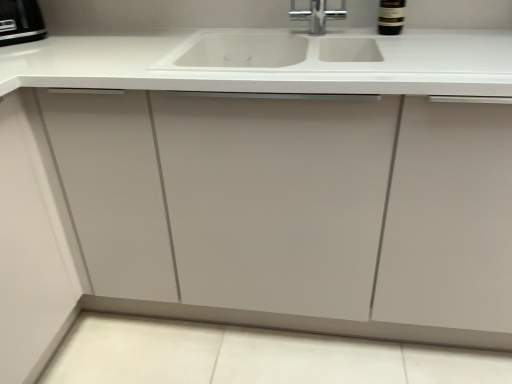
Question: Should I look upward or downward to see black plastic toaster at upper left?

Choices:
 (A) up
 (B) down

Answer: (A)

Question: Can you confirm if white matte sink at center is positioned to the left of black plastic toaster at upper left?

Choices:
 (A) no
 (B) yes

Answer: (A)

Question: Is white matte sink at center in front of black plastic toaster at upper left?

Choices:
 (A) no
 (B) yes

Answer: (B)

Question: Does white matte sink at center have a larger size compared to black plastic toaster at upper left?

Choices:
 (A) no
 (B) yes

Answer: (B)

Question: Does white matte sink at center have a greater height compared to black plastic toaster at upper left?

Choices:
 (A) yes
 (B) no

Answer: (A)

Question: Is white matte sink at center shorter than black plastic toaster at upper left?

Choices:
 (A) yes
 (B) no

Answer: (B)

Question: Is white matte sink at center turned away from black plastic toaster at upper left?

Choices:
 (A) yes
 (B) no

Answer: (B)

Question: From a real-world perspective, is dark brown glass bottle at upper right physically below white matte sink at center?

Choices:
 (A) yes
 (B) no

Answer: (B)

Question: Is dark brown glass bottle at upper right positioned beyond the bounds of white matte sink at center?

Choices:
 (A) no
 (B) yes

Answer: (B)

Question: Would you say dark brown glass bottle at upper right is a long distance from white matte sink at center?

Choices:
 (A) yes
 (B) no

Answer: (B)

Question: Is dark brown glass bottle at upper right facing towards white matte sink at center?

Choices:
 (A) yes
 (B) no

Answer: (B)

Question: Does dark brown glass bottle at upper right have a larger size compared to white matte sink at center?

Choices:
 (A) yes
 (B) no

Answer: (B)

Question: From a real-world perspective, is dark brown glass bottle at upper right located higher than white matte sink at center?

Choices:
 (A) no
 (B) yes

Answer: (B)

Question: Is black plastic toaster at upper left smaller than white matte sink at center?

Choices:
 (A) no
 (B) yes

Answer: (B)